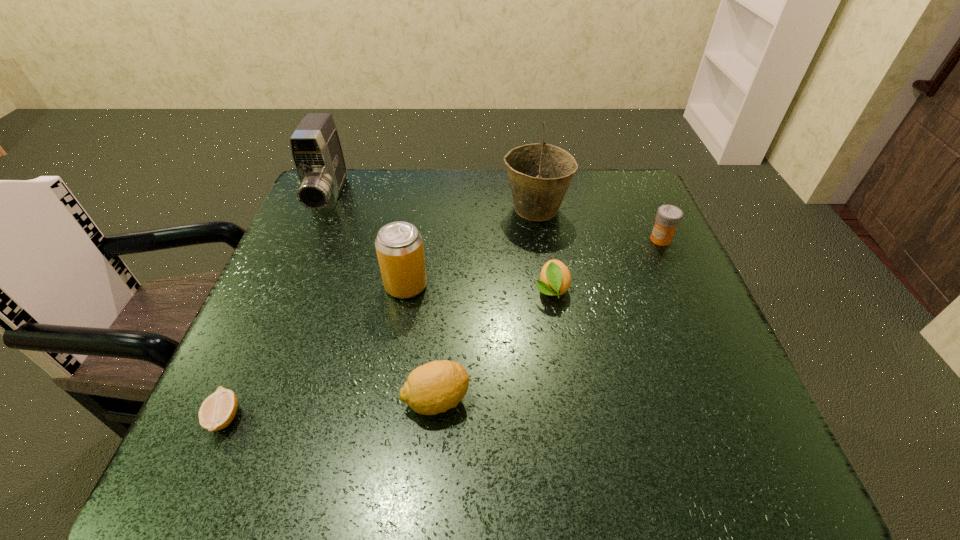
Image resolution: width=960 pixels, height=540 pixels. I want to click on vacant position in the image that satisfies the following two spatial constraints: 1. at the stem end of the second lemon from right to left; 2. on the front side of the leftmost lemon, so click(x=435, y=417).